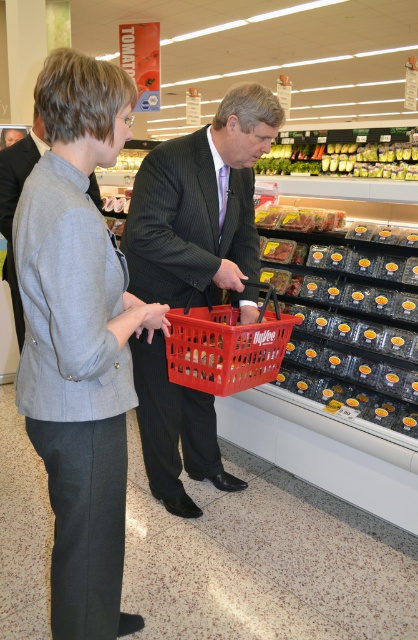
Does gray woolen blazer at left have a larger size compared to green leafy vegetables at upper center?

Incorrect, gray woolen blazer at left is not larger than green leafy vegetables at upper center.

Does gray woolen blazer at left have a greater width compared to green leafy vegetables at upper center?

No, gray woolen blazer at left is not wider than green leafy vegetables at upper center.

This screenshot has height=640, width=418. What do you see at coordinates (74, 388) in the screenshot? I see `gray woolen blazer at left` at bounding box center [74, 388].

Locate an element on the screen. Image resolution: width=418 pixels, height=640 pixels. gray woolen blazer at left is located at coordinates (74, 388).

How distant is gray woolen blazer at left from dark gray pinstripe suit at center?

The distance of gray woolen blazer at left from dark gray pinstripe suit at center is 81.41 centimeters.

Does gray woolen blazer at left appear over dark gray pinstripe suit at center?

Actually, gray woolen blazer at left is below dark gray pinstripe suit at center.

Image resolution: width=418 pixels, height=640 pixels. I want to click on gray woolen blazer at left, so click(74, 388).

Is translucent plastic basket at center to the left of green leafy vegetables at upper center from the viewer's perspective?

Indeed, translucent plastic basket at center is positioned on the left side of green leafy vegetables at upper center.

Between point (211, 372) and point (356, 176), which one is positioned in front?

Point (211, 372)

Is point (219, 378) more distant than point (272, 161)?

No, it is in front of (272, 161).

The height and width of the screenshot is (640, 418). What are the coordinates of `translucent plastic basket at center` in the screenshot? It's located at (226, 346).